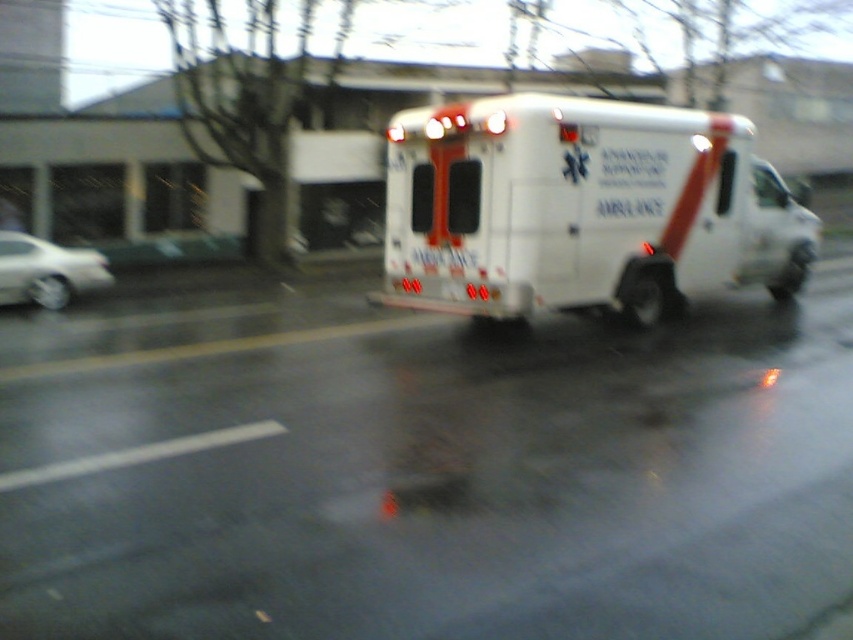
Does point (560, 140) come farther from viewer compared to point (44, 252)?

No, (560, 140) is closer to viewer.

Who is shorter, white glossy ambulance at center or silver metallic sedan at left?

silver metallic sedan at left

The height and width of the screenshot is (640, 853). I want to click on white glossy ambulance at center, so click(582, 209).

This screenshot has height=640, width=853. In order to click on white glossy ambulance at center in this screenshot , I will do `click(582, 209)`.